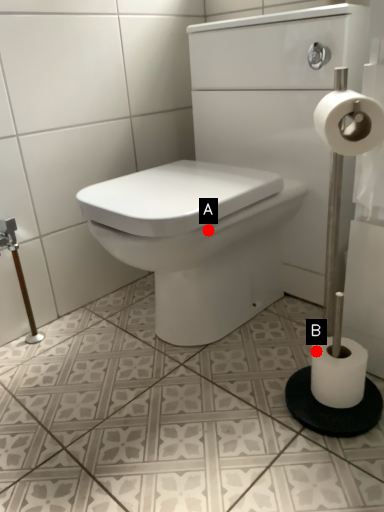
Question: Two points are circled on the image, labeled by A and B beside each circle. Which point is farther to the camera?

Choices:
 (A) A is further
 (B) B is further

Answer: (A)